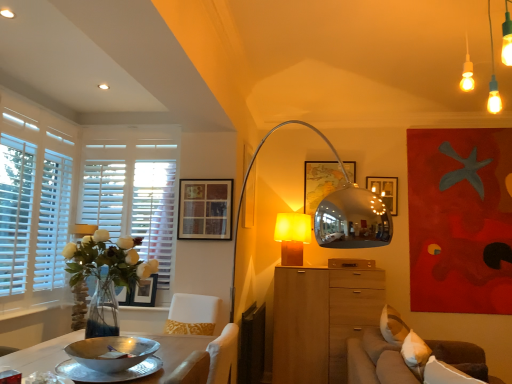
You are a GUI agent. You are given a task and a screenshot of the screen. Output one action in this format:
    pyautogui.click(x=<x>, y=<y>)
    Task: Click on the white wood window frame at left
    This screenshot has height=384, width=512.
    Given the screenshot: What is the action you would take?
    point(133,196)

This screenshot has width=512, height=384. I want to click on wooden drawer at center, so click(351, 263).

Describe the element at coordinates (493, 76) in the screenshot. This screenshot has height=384, width=512. I see `matte white pendant lights at upper right` at that location.

Locate an element on the screen. The height and width of the screenshot is (384, 512). wooden picture frame at center, which ranks as the 1th picture frame in back-to-front order is located at coordinates (385, 191).

Image resolution: width=512 pixels, height=384 pixels. Describe the element at coordinates (36, 312) in the screenshot. I see `white wood at lower left` at that location.

What is the approximate height of wooden cabinet at center?

The height of wooden cabinet at center is 1.14 meters.

The width and height of the screenshot is (512, 384). Find the location of `matte yellow glass lampshade at center`. matte yellow glass lampshade at center is located at coordinates (292, 236).

Considering the relative sizes of matte white pendant lights at upper right and white wooden blinds at left in the image provided, is matte white pendant lights at upper right bigger than white wooden blinds at left?

Yes.

From a real-world perspective, is matte white pendant lights at upper right above or below white wooden blinds at left?

From a real-world perspective, matte white pendant lights at upper right is physically above white wooden blinds at left.

From their relative heights in the image, would you say matte white pendant lights at upper right is taller or shorter than white wooden blinds at left?

In the image, matte white pendant lights at upper right appears to be shorter than white wooden blinds at left.

Is the surface of matte white pendant lights at upper right in direct contact with white wooden blinds at left?

matte white pendant lights at upper right and white wooden blinds at left are not in contact.

Considering the points (98, 358) and (387, 194), which point is in front, point (98, 358) or point (387, 194)?

The point (98, 358) is more forward.

Locate an element on the screen. This screenshot has height=384, width=512. bowl below the wooden picture frame at center, which is the third picture frame from bottom to top (from the image's perspective) is located at coordinates (111, 352).

In the scene shown: From the image's perspective, which one is positioned lower, silver metallic bowl at lower left or wooden picture frame at center, acting as the first picture frame starting from the right?

From the image's view, silver metallic bowl at lower left is below.

Can you tell me how much silver metallic bowl at lower left and wooden picture frame at center, the 3th picture frame positioned from the left, differ in facing direction?

The angle between the facing direction of silver metallic bowl at lower left and the facing direction of wooden picture frame at center, the 3th picture frame positioned from the left, is 86.5 degrees.

Between silver metallic bowl at lower left and matte yellow glass lampshade at center, which one has smaller width?

matte yellow glass lampshade at center is thinner.

Is silver metallic bowl at lower left to the left of matte yellow glass lampshade at center from the viewer's perspective?

Yes.

Based on their sizes in the image, would you say silver metallic bowl at lower left is bigger or smaller than matte yellow glass lampshade at center?

Clearly, silver metallic bowl at lower left is smaller in size than matte yellow glass lampshade at center.

Is silver metallic bowl at lower left oriented away from matte yellow glass lampshade at center?

That's not correct — silver metallic bowl at lower left is not looking away from matte yellow glass lampshade at center.

Between wooden picture frame at upper center, which is the 1th picture frame in front-to-back order, and brown fabric couch at lower right, which one has more height?

With more height is brown fabric couch at lower right.

From the image's perspective, is wooden picture frame at upper center, which is the 1th picture frame in front-to-back order, located above or below brown fabric couch at lower right?

wooden picture frame at upper center, which is the 1th picture frame in front-to-back order, is situated higher than brown fabric couch at lower right in the image.

How far apart are wooden picture frame at upper center, which is the second picture frame from right to left, and brown fabric couch at lower right?

The distance of wooden picture frame at upper center, which is the second picture frame from right to left, from brown fabric couch at lower right is 1.47 meters.

Can you confirm if matte white pendant lights at upper right is positioned to the left of brown fabric couch at lower right?

Correct, you'll find matte white pendant lights at upper right to the left of brown fabric couch at lower right.

Which object is more forward, matte white pendant lights at upper right or brown fabric couch at lower right?

matte white pendant lights at upper right is in front.

Is matte white pendant lights at upper right inside or outside of brown fabric couch at lower right?

matte white pendant lights at upper right is spatially situated outside brown fabric couch at lower right.

Is brown fabric couch at lower right at the back of matte white pendant lights at upper right?

That's not correct — matte white pendant lights at upper right is not looking away from brown fabric couch at lower right.

From a real-world perspective, between matte yellow glass lampshade at center and white wooden blinds at left, who is vertically lower?

matte yellow glass lampshade at center.

Which of these two, matte yellow glass lampshade at center or white wooden blinds at left, is thinner?

With smaller width is white wooden blinds at left.

From the image's perspective, is matte yellow glass lampshade at center located above or below white wooden blinds at left?

matte yellow glass lampshade at center is below white wooden blinds at left.

Is matte yellow glass lampshade at center turned away from white wooden blinds at left?

No, white wooden blinds at left is not at the back of matte yellow glass lampshade at center.

Could you tell me if wooden picture frame at upper center, which is the 1th picture frame in front-to-back order, is turned towards white wood at lower left?

No, wooden picture frame at upper center, which is the 1th picture frame in front-to-back order, is not oriented towards white wood at lower left.

Who is smaller, wooden picture frame at upper center, the second picture frame from the top, or white wood at lower left?

Smaller between the two is wooden picture frame at upper center, the second picture frame from the top.

At what (x,y) coordinates should I click in order to perform the action: click on light fixture located in front of the white wooden blinds at left. Please return your answer as a coordinate pair (x, y). The image size is (512, 384). Looking at the image, I should click on (493, 76).

From a real-world perspective, starting from the silver metallic bowl at lower left, which picture frame is the 3rd one vertically above it? Please provide its 2D coordinates.

[(385, 191)]

Considering their positions, is wooden drawer at center positioned closer to silver metallic bowl at lower left than silver metallic bowl at lower left?

The object closer to silver metallic bowl at lower left is silver metallic bowl at lower left.

Estimate the real-world distances between objects in this image. Which object is further from matte black picture frame at upper center, which ranks as the third picture frame in top-to-bottom order, silver metallic bowl at lower left or wooden picture frame at center, which is the 3th picture frame in front-to-back order?

wooden picture frame at center, which is the 3th picture frame in front-to-back order, is further to matte black picture frame at upper center, which ranks as the third picture frame in top-to-bottom order.

Which object lies further to the anchor point matte white pendant lights at upper right, white wooden blinds at left or wooden picture frame at center, which ranks as the 1th picture frame in back-to-front order?

Among the two, white wooden blinds at left is located further to matte white pendant lights at upper right.

When comparing their distances from wooden picture frame at upper center, which is the 2th picture frame from bottom to top, does matte black picture frame at upper center, which ranks as the third picture frame in top-to-bottom order, or wooden drawer at center seem closer?

The object closer to wooden picture frame at upper center, which is the 2th picture frame from bottom to top, is matte black picture frame at upper center, which ranks as the third picture frame in top-to-bottom order.

Considering their positions, is white wood window frame at left positioned closer to wooden drawer at center than matte black picture frame at upper center, which ranks as the third picture frame in top-to-bottom order?

The object closer to wooden drawer at center is matte black picture frame at upper center, which ranks as the third picture frame in top-to-bottom order.

When comparing their distances from silver metallic bowl at lower left, does brown fabric couch at lower right or white wood at lower left seem closer?

brown fabric couch at lower right is closer to silver metallic bowl at lower left.

Looking at this image, estimate the real-world distances between objects in this image. Which object is further from wooden cabinet at center, white wood at lower left or wooden picture frame at center, the first picture frame when ordered from top to bottom?

white wood at lower left.

Based on their spatial positions, is wooden picture frame at center, which is the 3th picture frame in front-to-back order, or matte black picture frame at upper center, which is counted as the third picture frame, starting from the right, closer to silver metallic bowl at lower left?

Among the two, matte black picture frame at upper center, which is counted as the third picture frame, starting from the right, is located nearer to silver metallic bowl at lower left.

You are a GUI agent. You are given a task and a screenshot of the screen. Output one action in this format:
    pyautogui.click(x=<x>, y=<y>)
    Task: Click on the window frame between wooden picture frame at upper center, arranged as the third picture frame when viewed from the back, and matte black picture frame at upper center, positioned as the first picture frame in bottom-to-top order, in the up-down direction
    The image size is (512, 384).
    Given the screenshot: What is the action you would take?
    pyautogui.click(x=133, y=196)

This screenshot has width=512, height=384. I want to click on picture frame positioned between silver metallic bowl at lower left and matte black picture frame at upper center, positioned as the first picture frame in bottom-to-top order, from near to far, so click(x=205, y=209).

Where is `window sill between white wooden blinds at left and white wood window frame at left in the front-back direction`? The image size is (512, 384). window sill between white wooden blinds at left and white wood window frame at left in the front-back direction is located at coordinates (36, 312).

Locate an element on the screen. The width and height of the screenshot is (512, 384). bowl positioned between silver metallic bowl at lower left and matte black picture frame at upper center, positioned as the first picture frame in bottom-to-top order, from near to far is located at coordinates (111, 352).